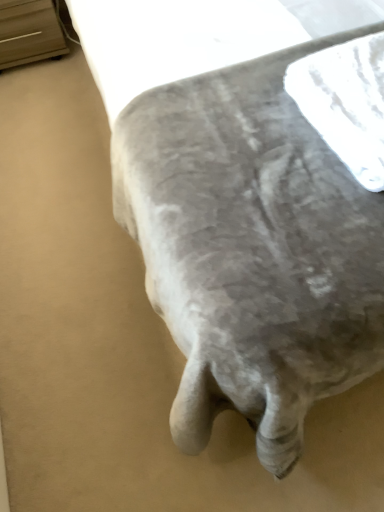
Question: Would you say matte wood dresser at upper left is to the left or to the right of white textured fabric at center in the picture?

Choices:
 (A) left
 (B) right

Answer: (A)

Question: Is matte wood dresser at upper left taller or shorter than white textured fabric at center?

Choices:
 (A) tall
 (B) short

Answer: (A)

Question: Looking at the image, does matte wood dresser at upper left seem bigger or smaller compared to white textured fabric at center?

Choices:
 (A) big
 (B) small

Answer: (A)

Question: Is point (306, 112) positioned closer to the camera than point (21, 41)?

Choices:
 (A) closer
 (B) farther

Answer: (A)

Question: Looking at the image, does white textured fabric at center seem bigger or smaller compared to matte wood dresser at upper left?

Choices:
 (A) big
 (B) small

Answer: (B)

Question: Is white textured fabric at center wider or thinner than matte wood dresser at upper left?

Choices:
 (A) wide
 (B) thin

Answer: (B)

Question: Considering their positions, is white textured fabric at center located in front of or behind matte wood dresser at upper left?

Choices:
 (A) front
 (B) behind

Answer: (A)